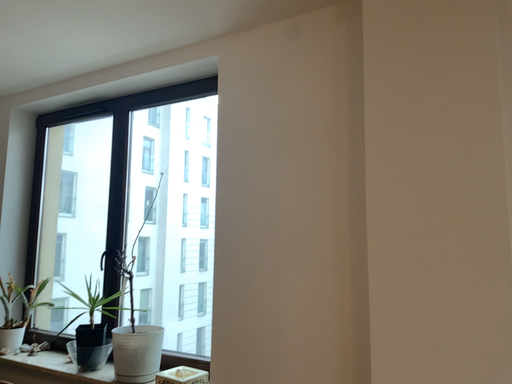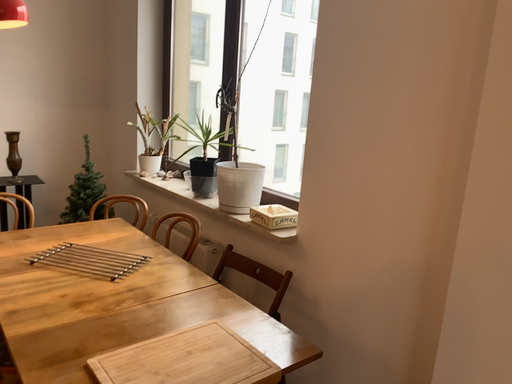
Question: Which way did the camera rotate in the video?

Choices:
 (A) rotated downward
 (B) rotated upward

Answer: (A)